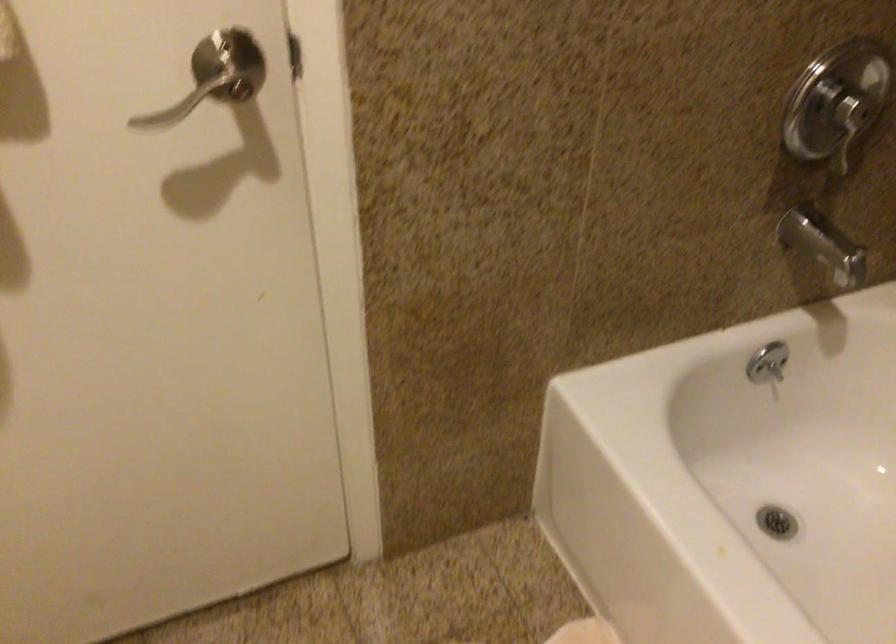
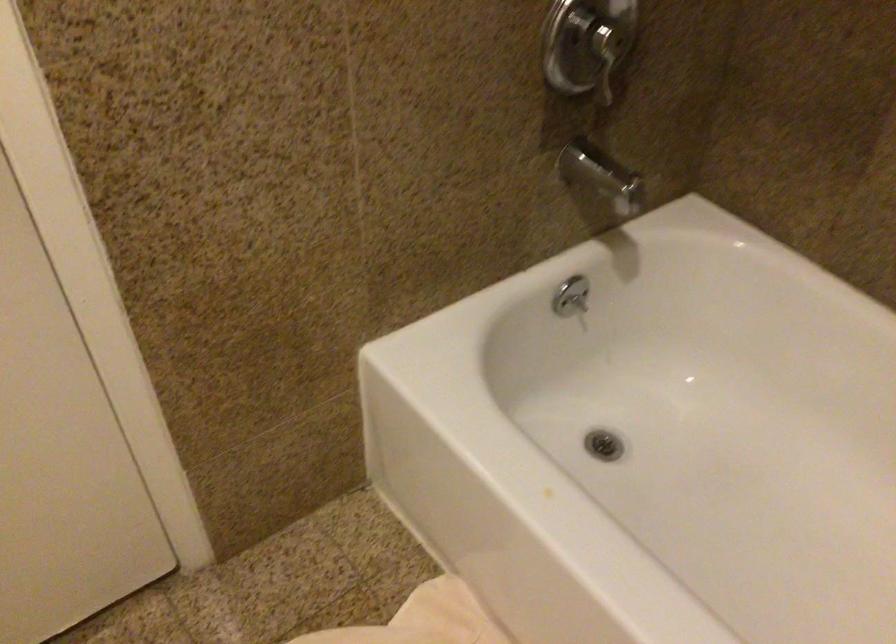
In a continuous first-person perspective shot, in which direction is the camera moving?

The cameraman walked toward right, forward.